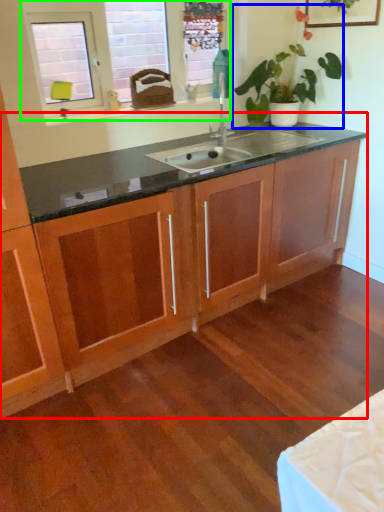
Question: Which object is the farthest from dresser (highlighted by a red box)? Choose among these: houseplant (highlighted by a blue box) or window (highlighted by a green box).

Choices:
 (A) houseplant
 (B) window

Answer: (B)